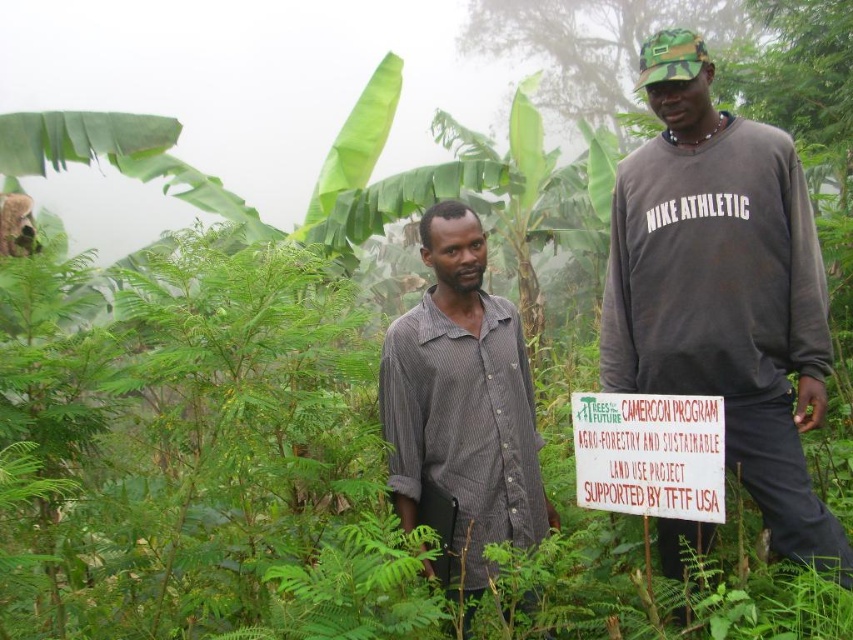
You are a photographer who needs to capture both the dark gray sweatshirt at center and the gray striped shirt at center in a single frame. Given that your camera has a limited focus range, which of the two should you prioritize focusing on to ensure clarity, considering their sizes?

The dark gray sweatshirt at center is bigger than the gray striped shirt at center, so you should prioritize focusing on the dark gray sweatshirt at center to ensure clarity since larger objects require more precise focus within the limited range.

You are a tailor measuring the width of two shirts for alterations. You have the dark gray sweatshirt at center and the gray striped shirt at center. Which shirt requires a wider alteration measurement?

The dark gray sweatshirt at center requires a wider alteration measurement because its width is larger than the gray striped shirt at center.